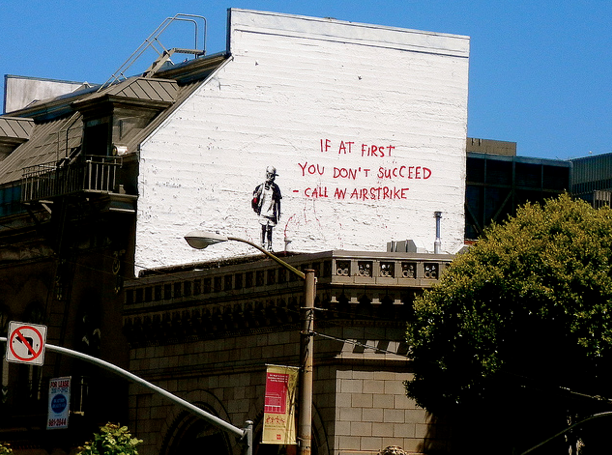
The image size is (612, 455). I want to click on stairs, so click(157, 61).